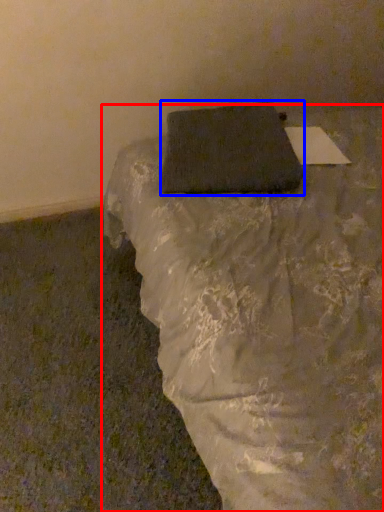
Question: Which object appears closest to the camera in this image, furniture (highlighted by a red box) or pillow (highlighted by a blue box)?

Choices:
 (A) furniture
 (B) pillow

Answer: (A)